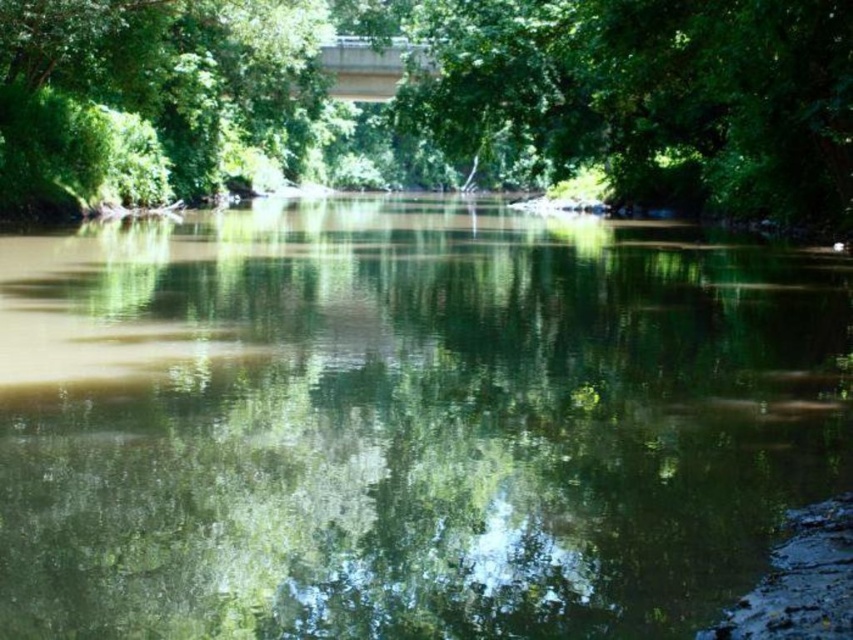
Which is more to the right, green leafy tree at center or concrete bridge at upper center?

green leafy tree at center

Is green leafy tree at center thinner than concrete bridge at upper center?

No.

Locate an element on the screen. Image resolution: width=853 pixels, height=640 pixels. green leafy tree at center is located at coordinates (433, 100).

Can you confirm if green reflective water at center is wider than green leafy tree at upper center?

Correct, the width of green reflective water at center exceeds that of green leafy tree at upper center.

Does green reflective water at center have a lesser height compared to green leafy tree at upper center?

Yes.

Which is behind, point (370, 369) or point (115, 72)?

Point (115, 72)

This screenshot has width=853, height=640. Find the location of `green reflective water at center`. green reflective water at center is located at coordinates (405, 420).

Does green leafy tree at center appear on the left side of green leafy tree at upper center?

No, green leafy tree at center is not to the left of green leafy tree at upper center.

Does green leafy tree at center have a smaller size compared to green leafy tree at upper center?

No, green leafy tree at center is not smaller than green leafy tree at upper center.

The image size is (853, 640). Identify the location of green leafy tree at center. (433, 100).

Where is `green leafy tree at center`? The height and width of the screenshot is (640, 853). green leafy tree at center is located at coordinates (433, 100).